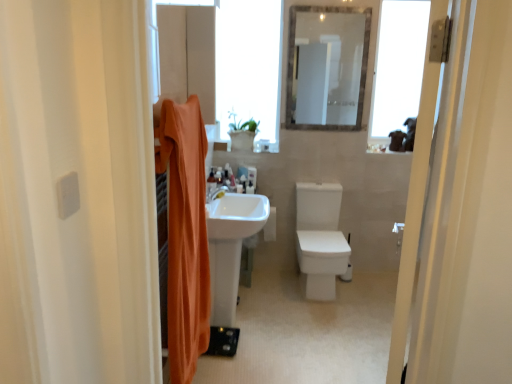
Measure the distance between point (338, 233) and camera.

3.49 meters.

The width and height of the screenshot is (512, 384). What do you see at coordinates (185, 234) in the screenshot?
I see `orange fabric shower curtain at left` at bounding box center [185, 234].

The width and height of the screenshot is (512, 384). Find the location of `matte plastic toothbrush at center, which is the 2th toiletry from front to back`. matte plastic toothbrush at center, which is the 2th toiletry from front to back is located at coordinates (250, 187).

The image size is (512, 384). Describe the element at coordinates (270, 226) in the screenshot. I see `white matte toilet paper at center` at that location.

Image resolution: width=512 pixels, height=384 pixels. What do you see at coordinates (230, 247) in the screenshot? I see `white glossy sink at center` at bounding box center [230, 247].

Where is `translucent plastic bottle at center, the third toiletry positioned from the front`? This screenshot has height=384, width=512. translucent plastic bottle at center, the third toiletry positioned from the front is located at coordinates (219, 175).

The width and height of the screenshot is (512, 384). In order to click on mirror located above the white glossy toilet at center (from the image's perspective) in this screenshot , I will do `click(327, 67)`.

From the image's perspective, is white glossy toilet at center on top of clear glass mirror at upper center?

No, from the image's perspective, white glossy toilet at center is not over clear glass mirror at upper center.

Is white glossy toilet at center positioned beyond the bounds of clear glass mirror at upper center?

That's correct, white glossy toilet at center is outside of clear glass mirror at upper center.

Can you confirm if white glossy toilet at center is thinner than clear glass mirror at upper center?

Incorrect, the width of white glossy toilet at center is not less than that of clear glass mirror at upper center.

Is point (253, 185) farther from camera compared to point (212, 196)?

Yes, it is.

Between matte plastic toothbrush at center, which appears as the first toiletry when viewed from the right, and white glossy tap at center, which one has smaller size?

matte plastic toothbrush at center, which appears as the first toiletry when viewed from the right, is smaller.

Measure the distance between matte plastic toothbrush at center, which is the 2th toiletry from front to back, and white glossy tap at center.

matte plastic toothbrush at center, which is the 2th toiletry from front to back, and white glossy tap at center are 17.10 inches apart.

Is matte plastic toothbrush at center, which is the 2th toiletry from front to back, thinner than white glossy tap at center?

Correct, the width of matte plastic toothbrush at center, which is the 2th toiletry from front to back, is less than that of white glossy tap at center.

Is translucent plastic bottle at center, positioned as the third toiletry in back-to-front order, bigger than transparent glass window at upper center, acting as the first window starting from the left?

Actually, translucent plastic bottle at center, positioned as the third toiletry in back-to-front order, might be smaller than transparent glass window at upper center, acting as the first window starting from the left.

From a real-world perspective, which is physically above, translucent plastic bottle at center, positioned as the third toiletry in back-to-front order, or transparent glass window at upper center, acting as the first window starting from the left?

transparent glass window at upper center, acting as the first window starting from the left, from a real-world perspective.

Does white matte toilet paper at center turn towards transparent glass window at upper right, the first window from the right?

No.

Is point (272, 217) closer or farther from the camera than point (378, 106)?

Point (272, 217) is farther from the camera than point (378, 106).

Is white matte toilet paper at center completely or partially outside of transparent glass window at upper right, arranged as the second window when viewed from the left?

Indeed, white matte toilet paper at center is completely outside transparent glass window at upper right, arranged as the second window when viewed from the left.

How distant is white matte toilet paper at center from transparent glass window at upper right, the first window from the right?

white matte toilet paper at center and transparent glass window at upper right, the first window from the right, are 1.57 meters apart from each other.

From the image's perspective, which one is positioned lower, translucent plastic bottle at center, positioned as the third toiletry in back-to-front order, or matte plastic toothbrush at center, the third toiletry from the left?

matte plastic toothbrush at center, the third toiletry from the left, is shown below in the image.

Is there a large distance between translucent plastic bottle at center, the 3th toiletry when ordered from right to left, and matte plastic toothbrush at center, which is the 2th toiletry from front to back?

No, translucent plastic bottle at center, the 3th toiletry when ordered from right to left, is in close proximity to matte plastic toothbrush at center, which is the 2th toiletry from front to back.

Looking at this image, who is smaller, translucent plastic bottle at center, positioned as the third toiletry in back-to-front order, or matte plastic toothbrush at center, the third toiletry from the left?

Smaller between the two is matte plastic toothbrush at center, the third toiletry from the left.

Can you confirm if translucent plastic bottle at center, positioned as the third toiletry in back-to-front order, is taller than matte plastic toothbrush at center, which is the 2th toiletry from front to back?

Indeed, translucent plastic bottle at center, positioned as the third toiletry in back-to-front order, has a greater height compared to matte plastic toothbrush at center, which is the 2th toiletry from front to back.

Based on the photo, is orange fabric shower curtain at left further to the viewer compared to white glossy tap at center?

No.

How far apart are orange fabric shower curtain at left and white glossy tap at center?

orange fabric shower curtain at left and white glossy tap at center are 27.12 inches apart.

Considering the relative positions of orange fabric shower curtain at left and white glossy tap at center in the image provided, is orange fabric shower curtain at left to the left or to the right of white glossy tap at center?

In the image, orange fabric shower curtain at left appears on the left side of white glossy tap at center.

From a real-world perspective, is orange fabric shower curtain at left physically above white glossy tap at center?

No, from a real-world perspective, orange fabric shower curtain at left is not above white glossy tap at center.

Who is bigger, orange fabric shower curtain at left or white matte toilet paper at center?

Bigger between the two is orange fabric shower curtain at left.

Looking at this image, from a real-world perspective, is orange fabric shower curtain at left physically above white matte toilet paper at center?

Indeed, from a real-world perspective, orange fabric shower curtain at left stands above white matte toilet paper at center.

Could you tell me if orange fabric shower curtain at left is facing white matte toilet paper at center?

No, orange fabric shower curtain at left is not facing towards white matte toilet paper at center.

Where is `mirror on the right of the white glossy toilet at center`? mirror on the right of the white glossy toilet at center is located at coordinates (327, 67).

Locate an element on the screen. tap in front of the matte plastic toothbrush at center, which is the 2th toiletry from front to back is located at coordinates (216, 193).

Based on their spatial positions, is orange fabric shower curtain at left or white glossy sink at center further from transparent glass window at upper right, the first window from the right?

orange fabric shower curtain at left is positioned further to the anchor transparent glass window at upper right, the first window from the right.

Considering their positions, is transparent glass window at upper right, the first window from the right, positioned further to transparent glass window at upper center, acting as the second window starting from the right, than white matte toilet paper at center?

The object further to transparent glass window at upper center, acting as the second window starting from the right, is white matte toilet paper at center.

Estimate the real-world distances between objects in this image. Which object is closer to white matte toilet paper at center, white glossy toilet at center or translucent plastic bottle at center, the 3th toiletry when ordered from right to left?

white glossy toilet at center is positioned closer to the anchor white matte toilet paper at center.

Considering their positions, is matte plastic toothbrush at center, the 2th toiletry positioned from the back, positioned further to white matte toilet paper at center than translucent plastic bottle at center, arranged as the 1th toiletry when viewed from the back?

translucent plastic bottle at center, arranged as the 1th toiletry when viewed from the back, is further to white matte toilet paper at center.

From the image, which object appears to be nearer to white glossy tap at center, transparent glass window at upper right, the first window from the right, or clear glass mirror at upper center?

clear glass mirror at upper center is positioned closer to the anchor white glossy tap at center.

From the image, which object appears to be nearer to transparent glass window at upper right, the first window from the right, translucent plastic bottle at center, positioned as the third toiletry in back-to-front order, or white glossy toilet at center?

The object closer to transparent glass window at upper right, the first window from the right, is white glossy toilet at center.

Looking at the image, which one is located closer to white matte toilet paper at center, clear glass mirror at upper center or white glossy sink at center?

Among the two, white glossy sink at center is located nearer to white matte toilet paper at center.

Which object lies further to the anchor point white glossy sink at center, white matte toilet paper at center or transparent glass window at upper right, arranged as the second window when viewed from the left?

transparent glass window at upper right, arranged as the second window when viewed from the left, lies further to white glossy sink at center than the other object.

I want to click on mirror that lies between transparent glass window at upper right, the first window from the right, and white glossy sink at center from top to bottom, so click(x=327, y=67).

This screenshot has height=384, width=512. What are the coordinates of `tap between orange fabric shower curtain at left and transparent glass window at upper center, acting as the first window starting from the left, from front to back` in the screenshot? It's located at coord(216,193).

Find the location of `tap positioned between orange fabric shower curtain at left and clear glass mirror at upper center from near to far`. tap positioned between orange fabric shower curtain at left and clear glass mirror at upper center from near to far is located at coordinates (216, 193).

Image resolution: width=512 pixels, height=384 pixels. I want to click on mirror between transparent glass window at upper center, acting as the first window starting from the left, and white matte toilet paper at center, in the vertical direction, so click(327, 67).